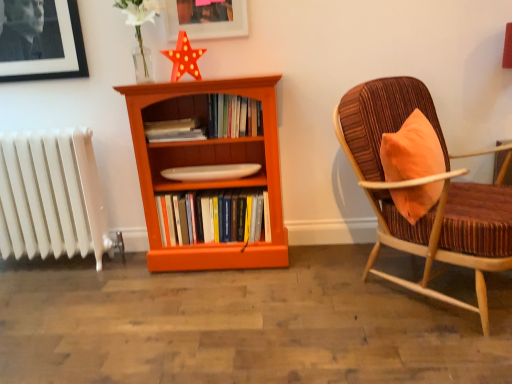
Identify the location of free location in front of white painted radiator at left. (46, 301).